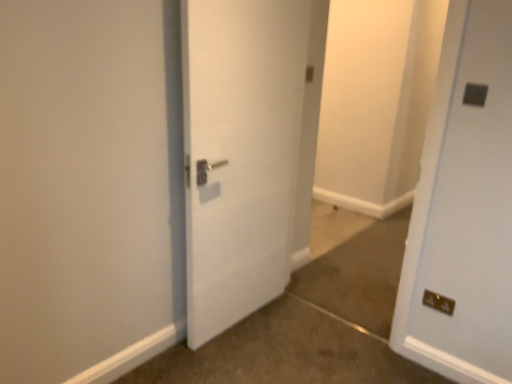
The image size is (512, 384). Find the location of `vacant area in front of white matte door at center`. vacant area in front of white matte door at center is located at coordinates (240, 357).